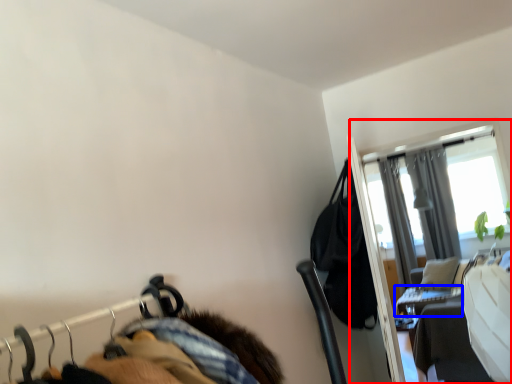
Question: Which object is closer to the camera taking this photo, screen door (highlighted by a red box) or table (highlighted by a blue box)?

Choices:
 (A) screen door
 (B) table

Answer: (A)